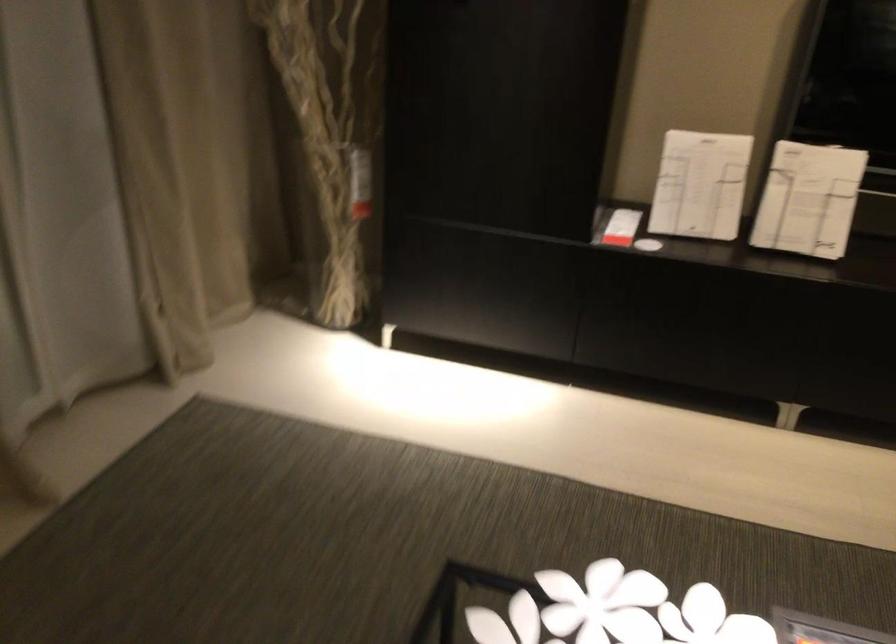
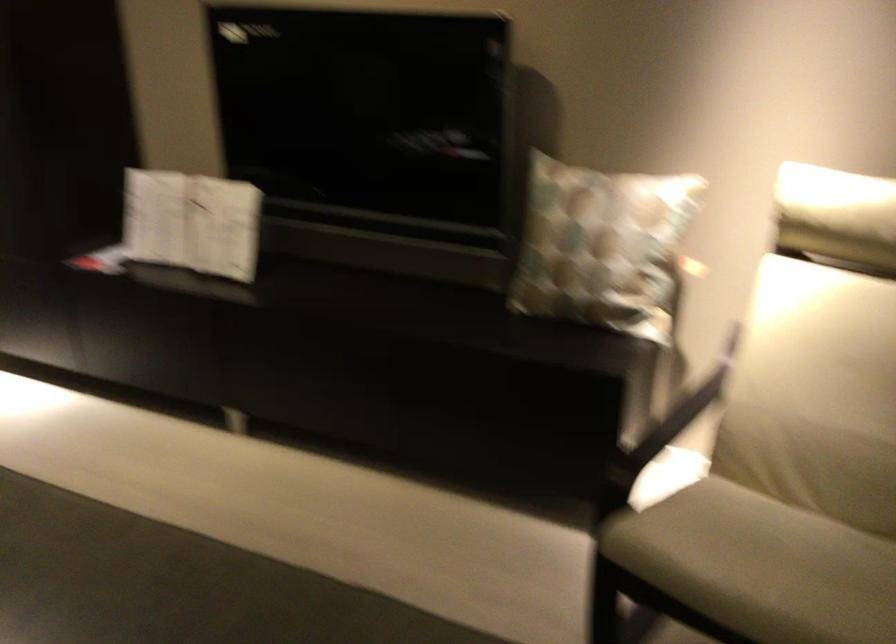
Question: I am providing you with two images of the same scene from different viewpoints. Which of the following objects are not visible in image2?

Choices:
 (A) folded white booklet
 (B) dark chair armrest
 (C) chair sitting surface
 (D) none of these

Answer: (D)